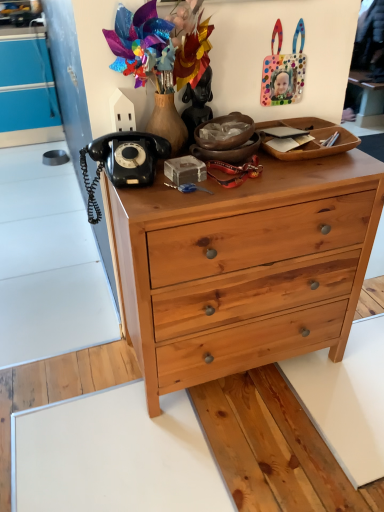
Question: Looking at their shapes, would you say black matte statue at upper center is wider or thinner than black rubberized telephone at upper left?

Choices:
 (A) wide
 (B) thin

Answer: (B)

Question: From the image's perspective, relative to black rubberized telephone at upper left, is black matte statue at upper center above or below?

Choices:
 (A) above
 (B) below

Answer: (A)

Question: Estimate the real-world distances between objects in this image. Which object is closer to the black matte statue at upper center?

Choices:
 (A) natural wood chest of drawers at center
 (B) polka dot plastic handbag at upper right
 (C) black rubberized telephone at upper left

Answer: (C)

Question: Estimate the real-world distances between objects in this image. Which object is farther from the natural wood chest of drawers at center?

Choices:
 (A) polka dot plastic handbag at upper right
 (B) black rubberized telephone at upper left
 (C) black matte statue at upper center

Answer: (A)